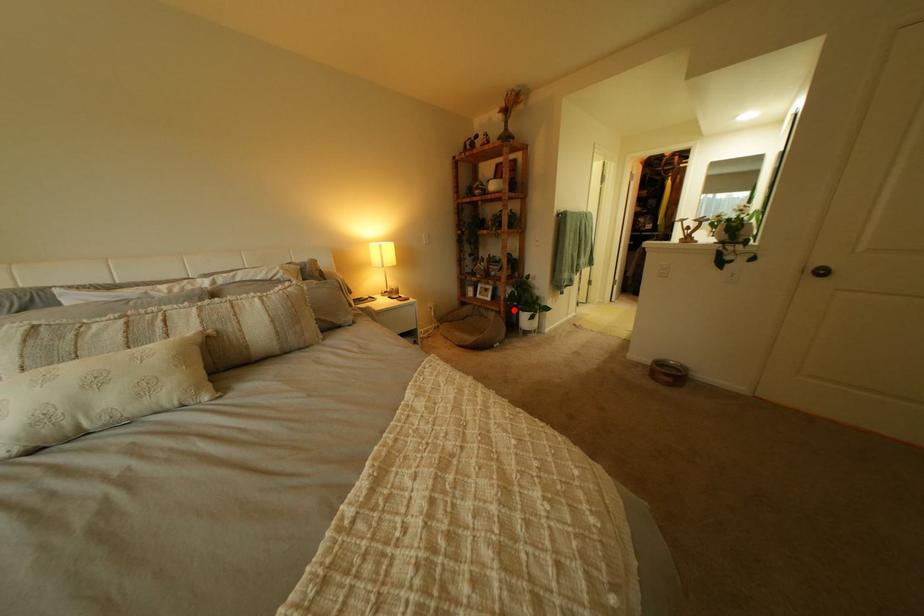
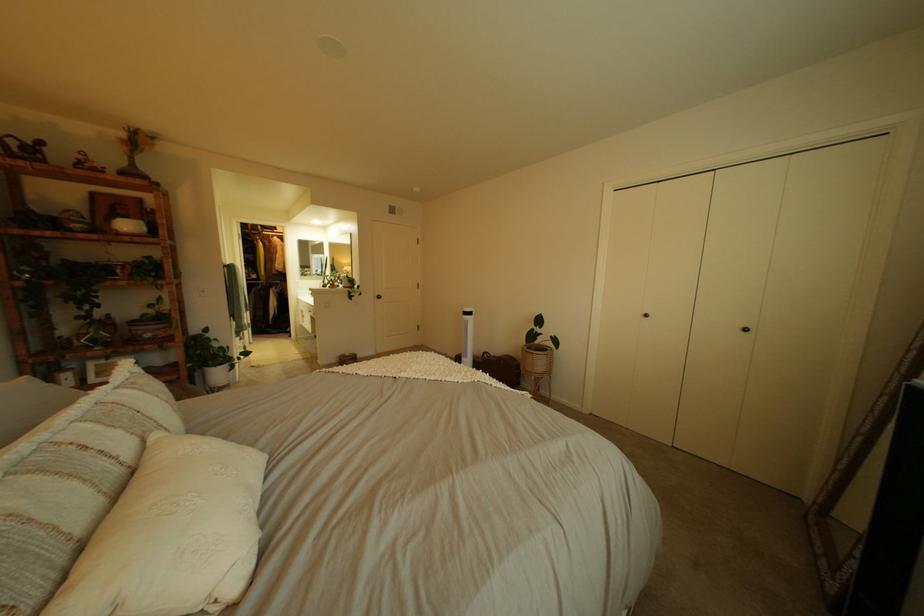
Find the pixel in the second image that matches the highlighted location in the first image.

(189, 379)